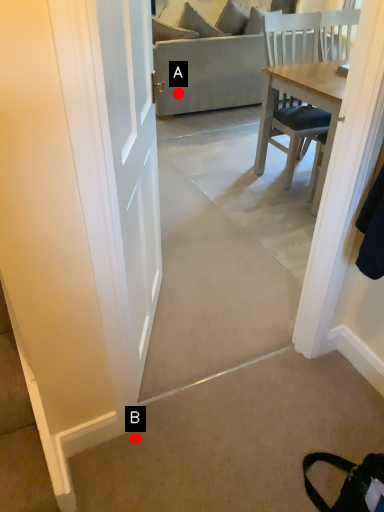
Question: Two points are circled on the image, labeled by A and B beside each circle. Among these points, which one is nearest to the camera?

Choices:
 (A) A is closer
 (B) B is closer

Answer: (B)